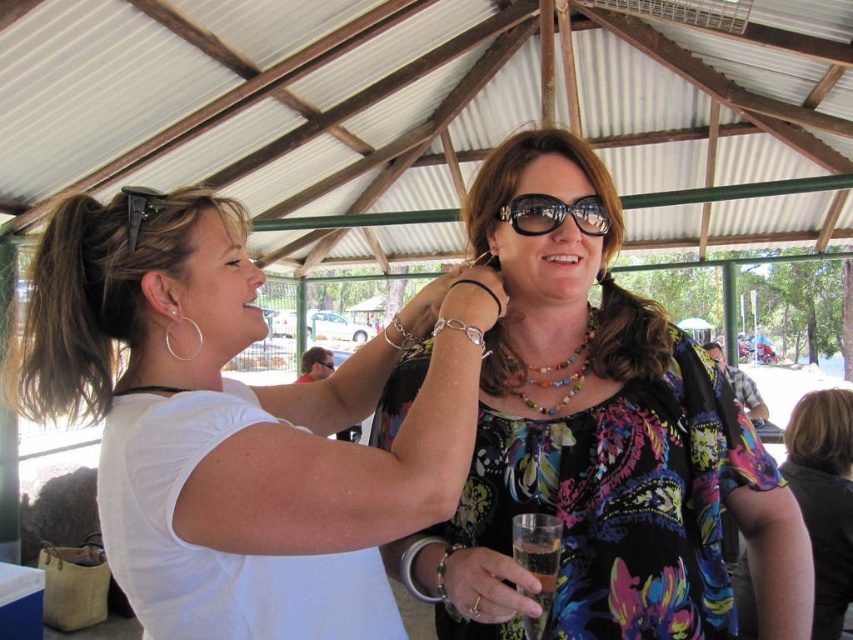
Question: Does multicolored floral blouse at center appear under dark brown hair at lower right?

Choices:
 (A) no
 (B) yes

Answer: (A)

Question: Which is nearer to the clear plastic glass at center?

Choices:
 (A) multicolored floral blouse at center
 (B) shiny black sunglasses at center

Answer: (A)

Question: Which point appears closest to the camera in this image?

Choices:
 (A) (550, 374)
 (B) (534, 218)
 (C) (491, 548)

Answer: (C)

Question: Among these objects, which one is nearest to the camera?

Choices:
 (A) multicolored floral blouse at center
 (B) white matte shirt at upper left
 (C) dark brown hair at lower right
 (D) shiny black sunglasses at center

Answer: (B)

Question: Can you confirm if white matte shirt at upper left is smaller than multicolored beaded necklace at center?

Choices:
 (A) yes
 (B) no

Answer: (B)

Question: Does white matte shirt at upper left appear on the right side of dark brown hair at lower right?

Choices:
 (A) yes
 (B) no

Answer: (B)